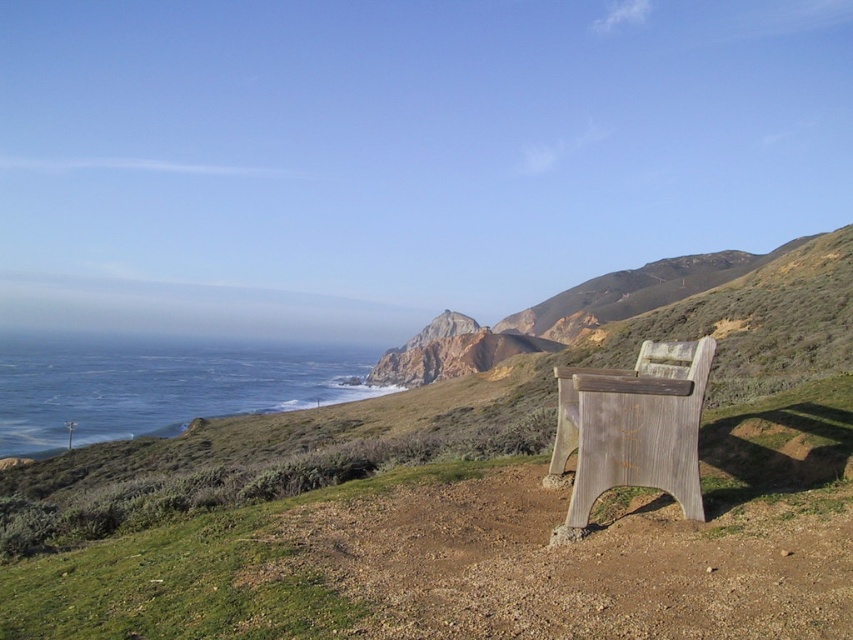
Which is in front, point (273, 378) or point (556, 456)?

Point (556, 456) is in front.

Can you confirm if blue water at lower left is bigger than weathered wood park bench at right?

Yes, blue water at lower left is bigger than weathered wood park bench at right.

Who is more forward, (308, 385) or (560, 376)?

Point (560, 376)

Locate an element on the screen. The height and width of the screenshot is (640, 853). blue water at lower left is located at coordinates (158, 385).

Describe the element at coordinates (490, 554) in the screenshot. This screenshot has height=640, width=853. I see `green grassy at lower left` at that location.

Can you confirm if green grassy at lower left is shorter than weathered wood park bench at right?

Correct, green grassy at lower left is not as tall as weathered wood park bench at right.

Describe the element at coordinates (490, 554) in the screenshot. I see `green grassy at lower left` at that location.

The height and width of the screenshot is (640, 853). I want to click on green grassy at lower left, so click(x=490, y=554).

The image size is (853, 640). I want to click on green grassy at lower left, so click(490, 554).

Does green grassy at lower left have a smaller size compared to blue water at lower left?

Indeed, green grassy at lower left has a smaller size compared to blue water at lower left.

Who is more distant from viewer, (251, 593) or (119, 426)?

The point (119, 426) is behind.

Identify the location of green grassy at lower left. Image resolution: width=853 pixels, height=640 pixels. (490, 554).